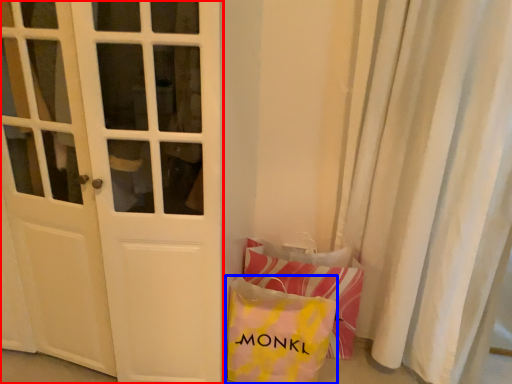
Question: Which of the following is the farthest to the observer, door (highlighted by a red box) or pouch (highlighted by a blue box)?

Choices:
 (A) door
 (B) pouch

Answer: (B)